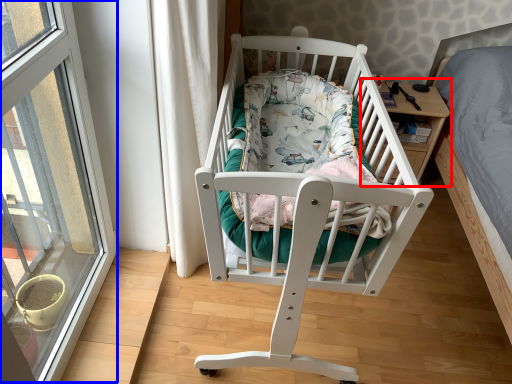
Question: Which object appears farthest to the camera in this image, table (highlighted by a red box) or window (highlighted by a blue box)?

Choices:
 (A) table
 (B) window

Answer: (A)